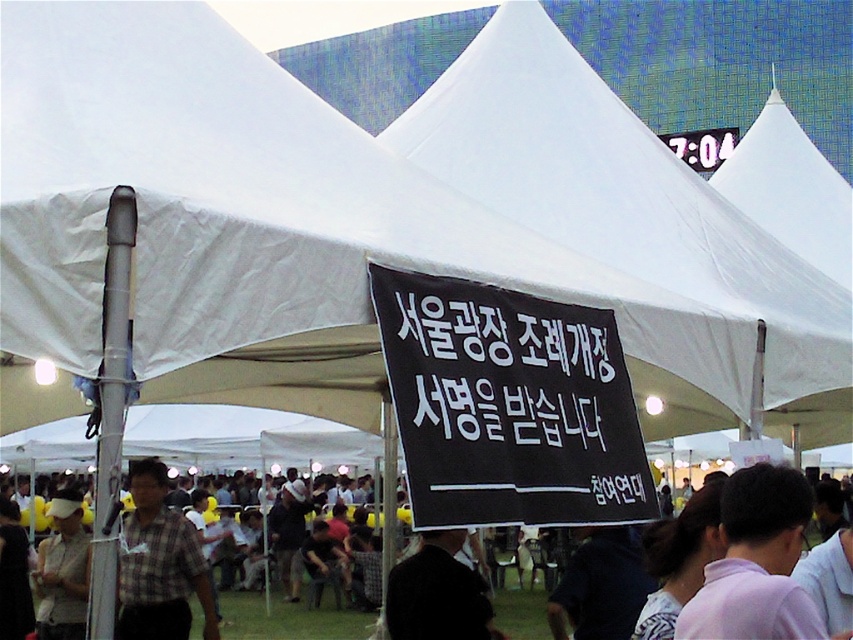
Is the position of plaid shirt at center more distant than that of black fabric at center?

No, it is in front of black fabric at center.

Who is higher up, plaid shirt at center or black fabric at center?

Positioned higher is plaid shirt at center.

This screenshot has height=640, width=853. What are the coordinates of `plaid shirt at center` in the screenshot? It's located at (160, 564).

Between pink fabric shirt at lower right and plaid shirt at center, which one appears on the left side from the viewer's perspective?

plaid shirt at center is more to the left.

The height and width of the screenshot is (640, 853). Describe the element at coordinates (756, 563) in the screenshot. I see `pink fabric shirt at lower right` at that location.

At what (x,y) coordinates should I click in order to perform the action: click on pink fabric shirt at lower right. Please return your answer as a coordinate pair (x, y). Looking at the image, I should click on (756, 563).

Between plaid shirt at center and light beige fabric cap at lower left, which one has more height?

light beige fabric cap at lower left

Can you confirm if plaid shirt at center is taller than light beige fabric cap at lower left?

No, plaid shirt at center is not taller than light beige fabric cap at lower left.

Which is behind, point (169, 580) or point (65, 529)?

The point (65, 529) is more distant.

I want to click on plaid shirt at center, so click(160, 564).